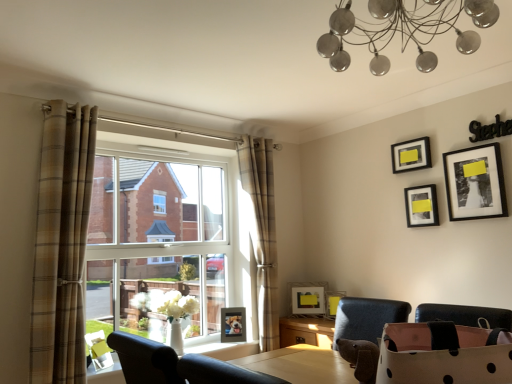
Question: Considering the relative sizes of matte black picture frame at center, the 2th picture frame from the bottom, and matte black picture frame at upper right, the 3th picture frame when ordered from right to left, in the image provided, is matte black picture frame at center, the 2th picture frame from the bottom, smaller than matte black picture frame at upper right, the 3th picture frame when ordered from right to left,?

Choices:
 (A) no
 (B) yes

Answer: (A)

Question: Considering the relative sizes of matte black picture frame at center, the 2th picture frame from the bottom, and matte black picture frame at upper right, the 3th picture frame when ordered from right to left, in the image provided, is matte black picture frame at center, the 2th picture frame from the bottom, thinner than matte black picture frame at upper right, the 3th picture frame when ordered from right to left,?

Choices:
 (A) no
 (B) yes

Answer: (A)

Question: Is matte black picture frame at center, which appears as the fourth picture frame when viewed from the right, to the left of matte black picture frame at upper right, placed as the 6th picture frame when sorted from bottom to top, from the viewer's perspective?

Choices:
 (A) yes
 (B) no

Answer: (A)

Question: Considering the relative positions of matte black picture frame at center, the 2th picture frame from the bottom, and matte black picture frame at upper right, which ranks as the 4th picture frame in left-to-right order, in the image provided, is matte black picture frame at center, the 2th picture frame from the bottom, to the right of matte black picture frame at upper right, which ranks as the 4th picture frame in left-to-right order, from the viewer's perspective?

Choices:
 (A) yes
 (B) no

Answer: (B)

Question: Is matte black picture frame at center, the 2th picture frame from the bottom, further to the viewer compared to matte black picture frame at upper right, placed as the 6th picture frame when sorted from bottom to top?

Choices:
 (A) no
 (B) yes

Answer: (B)

Question: Is black matte picture frame at upper right, marked as the 6th picture frame in a left-to-right arrangement, taller or shorter than matte black picture frame at upper right, placed as the 6th picture frame when sorted from bottom to top?

Choices:
 (A) tall
 (B) short

Answer: (A)

Question: Looking at the image, does black matte picture frame at upper right, the 2th picture frame positioned from the top, seem bigger or smaller compared to matte black picture frame at upper right, the 1th picture frame in the top-to-bottom sequence?

Choices:
 (A) small
 (B) big

Answer: (B)

Question: Considering the positions of point (454, 203) and point (425, 142), is point (454, 203) closer or farther from the camera than point (425, 142)?

Choices:
 (A) farther
 (B) closer

Answer: (B)

Question: From the image's perspective, relative to matte black picture frame at upper right, the 3th picture frame when ordered from right to left, is black matte picture frame at upper right, the 2th picture frame positioned from the top, above or below?

Choices:
 (A) above
 (B) below

Answer: (B)

Question: Considering the positions of point (411, 208) and point (457, 185), is point (411, 208) closer or farther from the camera than point (457, 185)?

Choices:
 (A) closer
 (B) farther

Answer: (B)

Question: In terms of size, does matte black picture frame at center-right, the 3th picture frame when ordered from top to bottom, appear bigger or smaller than black matte picture frame at upper right, the first picture frame when ordered from right to left?

Choices:
 (A) big
 (B) small

Answer: (B)

Question: Is matte black picture frame at center-right, placed as the 5th picture frame when sorted from left to right, taller or shorter than black matte picture frame at upper right, marked as the 6th picture frame in a left-to-right arrangement?

Choices:
 (A) tall
 (B) short

Answer: (B)

Question: In terms of width, does matte black picture frame at center-right, the 3th picture frame when ordered from top to bottom, look wider or thinner when compared to black matte picture frame at upper right, the 2th picture frame positioned from the top?

Choices:
 (A) wide
 (B) thin

Answer: (B)

Question: From a real-world perspective, is clear glass window at center positioned above or below black matte picture frame at upper right, arranged as the 5th picture frame when ordered from the bottom?

Choices:
 (A) below
 (B) above

Answer: (A)

Question: Is point (155, 215) closer or farther from the camera than point (493, 155)?

Choices:
 (A) farther
 (B) closer

Answer: (A)